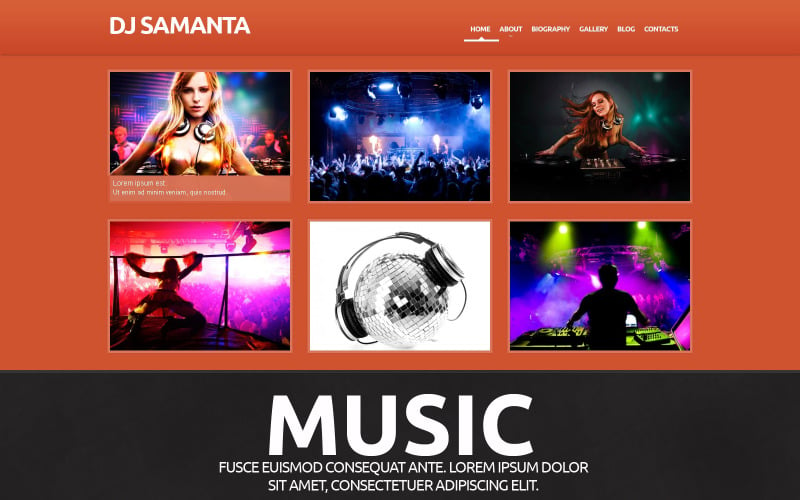
Locate an element on the screen. Image resolution: width=800 pixels, height=500 pixels. white spotlights is located at coordinates (341, 114), (386, 85), (416, 118), (477, 102).